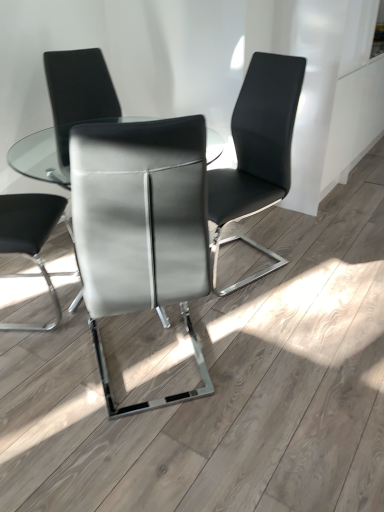
Locate an element on the screen. The image size is (384, 512). free space between satin gray leather chair at center, marked as the second chair in a right-to-left arrangement, and clear glass table at center is located at coordinates (152, 340).